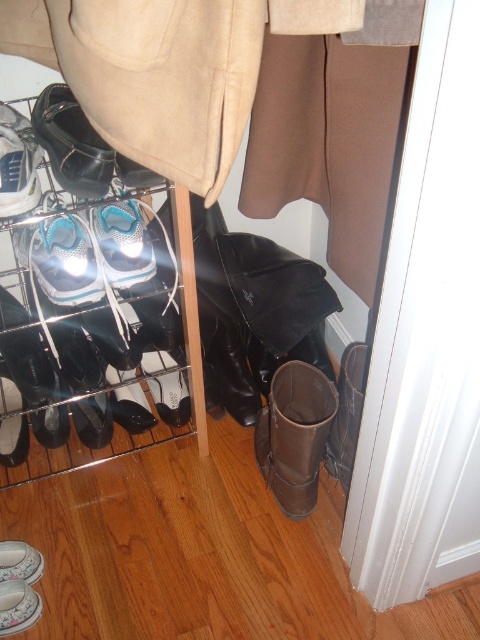
Question: Which point appears farthest from the camera in this image?

Choices:
 (A) (23, 577)
 (B) (162, 369)

Answer: (B)

Question: Does white suede shoe at center have a greater width compared to white leather shoe at lower left?

Choices:
 (A) yes
 (B) no

Answer: (A)

Question: Considering the relative positions of silver metallic shoe at center and leather boot at lower center in the image provided, where is silver metallic shoe at center located with respect to leather boot at lower center?

Choices:
 (A) left
 (B) right

Answer: (A)

Question: Is silver metallic shoe at center in front of brown leather boot at lower right?

Choices:
 (A) no
 (B) yes

Answer: (B)

Question: Among these objects, which one is farthest from the camera?

Choices:
 (A) white suede shoe at lower left
 (B) brown leather boot at lower right
 (C) white suede shoe at center

Answer: (C)

Question: Which object appears closest to the camera in this image?

Choices:
 (A) leather boot at lower center
 (B) white rubber shoe at lower left

Answer: (B)